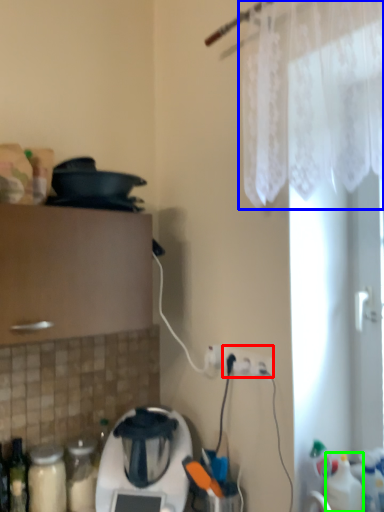
Question: Considering the real-world distances, which object is farthest from electric outlet (highlighted by a red box)? curtain (highlighted by a blue box) or bottle (highlighted by a green box)?

Choices:
 (A) curtain
 (B) bottle

Answer: (A)